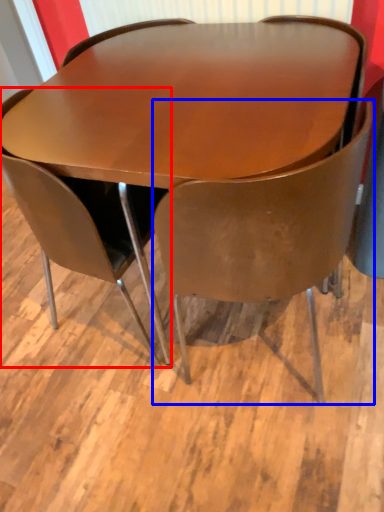
Question: Among these objects, which one is nearest to the camera, chair (highlighted by a red box) or chair (highlighted by a blue box)?

Choices:
 (A) chair
 (B) chair

Answer: (B)